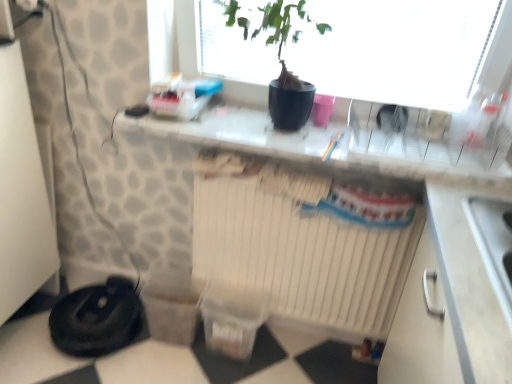
What do you see at coordinates (334, 150) in the screenshot? I see `white glossy countertop at center` at bounding box center [334, 150].

Where is `black matte pot at upper center`? This screenshot has height=384, width=512. black matte pot at upper center is located at coordinates (286, 67).

The image size is (512, 384). Identify the location of white glossy countertop at center. (334, 150).

Considering the sizes of white glossy countertop at center and white matte radiator at center in the image, is white glossy countertop at center bigger or smaller than white matte radiator at center?

Clearly, white glossy countertop at center is smaller in size than white matte radiator at center.

Can you confirm if white glossy countertop at center is positioned to the right of white matte radiator at center?

Yes, white glossy countertop at center is to the right of white matte radiator at center.

Which object is further away from the camera taking this photo, white glossy countertop at center or white matte radiator at center?

white matte radiator at center is further from the camera.

Consider the image. Is white matte radiator at center to the left or to the right of black rubber vacuum cleaner at lower left in the image?

white matte radiator at center is positioned on black rubber vacuum cleaner at lower left's right side.

Is white matte radiator at center inside or outside of black rubber vacuum cleaner at lower left?

white matte radiator at center is not inside black rubber vacuum cleaner at lower left, it's outside.

Considering the positions of point (323, 307) and point (92, 301), is point (323, 307) closer or farther from the camera than point (92, 301)?

Point (323, 307) is positioned closer to the camera compared to point (92, 301).

Is white matte radiator at center placed right next to black rubber vacuum cleaner at lower left?

No, white matte radiator at center is not with black rubber vacuum cleaner at lower left.

Is black matte pot at upper center not near black rubber vacuum cleaner at lower left?

Yes, black matte pot at upper center is far from black rubber vacuum cleaner at lower left.

Is black rubber vacuum cleaner at lower left completely or partially inside black matte pot at upper center?

No, black rubber vacuum cleaner at lower left is located outside of black matte pot at upper center.

In the image, is white glossy countertop at center on the left side or the right side of black rubber vacuum cleaner at lower left?

white glossy countertop at center is to the right of black rubber vacuum cleaner at lower left.

Is white glossy countertop at center placed right next to black rubber vacuum cleaner at lower left?

No, white glossy countertop at center is not making contact with black rubber vacuum cleaner at lower left.

From the image's perspective, is white glossy countertop at center beneath black rubber vacuum cleaner at lower left?

Incorrect, from the image's perspective, white glossy countertop at center is higher than black rubber vacuum cleaner at lower left.

Locate an element on the screen. counter top on the right of black rubber vacuum cleaner at lower left is located at coordinates (334, 150).

This screenshot has height=384, width=512. What are the coordinates of `counter top lying on the right of black matte pot at upper center` in the screenshot? It's located at (334, 150).

Which object is positioned more to the left, black matte pot at upper center or white glossy countertop at center?

From the viewer's perspective, black matte pot at upper center appears more on the left side.

Is black matte pot at upper center next to white glossy countertop at center?

No, black matte pot at upper center is not in contact with white glossy countertop at center.

Considering their positions, is black matte pot at upper center located in front of or behind white glossy countertop at center?

Clearly, black matte pot at upper center is in front of white glossy countertop at center.

Is white glossy countertop at center not inside black matte pot at upper center?

Yes.

Which of these two, white glossy countertop at center or black matte pot at upper center, stands shorter?

white glossy countertop at center.

Looking at this image, can you confirm if white glossy countertop at center is thinner than black matte pot at upper center?

No.

Is the surface of white glossy countertop at center in direct contact with black matte pot at upper center?

white glossy countertop at center and black matte pot at upper center are not in contact.

Does point (49, 324) appear closer or farther from the camera than point (309, 103)?

Clearly, point (49, 324) is more distant from the camera than point (309, 103).

Is black rubber vacuum cleaner at lower left facing towards black matte pot at upper center?

No, black rubber vacuum cleaner at lower left does not turn towards black matte pot at upper center.

From the image's perspective, which one is positioned higher, black rubber vacuum cleaner at lower left or black matte pot at upper center?

black matte pot at upper center is shown above in the image.

Where is `houseplant on the right side of black rubber vacuum cleaner at lower left`? This screenshot has width=512, height=384. houseplant on the right side of black rubber vacuum cleaner at lower left is located at coordinates (286, 67).

You are a GUI agent. You are given a task and a screenshot of the screen. Output one action in this format:
    pyautogui.click(x=<x>, y=<y>)
    Task: Click on the counter top above the white matte radiator at center (from the image's perspective)
    The height and width of the screenshot is (384, 512).
    Given the screenshot: What is the action you would take?
    pyautogui.click(x=334, y=150)

At what (x,y) coordinates should I click in order to perform the action: click on appliance below the white matte radiator at center (from the image's perspective). Please return your answer as a coordinate pair (x, y). Looking at the image, I should click on (97, 318).

When comparing their distances from black rubber vacuum cleaner at lower left, does white matte radiator at center or white glossy countertop at center seem further?

white glossy countertop at center is positioned further to the anchor black rubber vacuum cleaner at lower left.

Looking at the image, which one is located further to white glossy countertop at center, black matte pot at upper center or black rubber vacuum cleaner at lower left?

Based on the image, black rubber vacuum cleaner at lower left appears to be further to white glossy countertop at center.

From the image, which object appears to be farther from white glossy countertop at center, black rubber vacuum cleaner at lower left or white matte radiator at center?

The object further to white glossy countertop at center is black rubber vacuum cleaner at lower left.

From the image, which object appears to be nearer to white glossy countertop at center, black rubber vacuum cleaner at lower left or black matte pot at upper center?

black matte pot at upper center.

Considering their positions, is black rubber vacuum cleaner at lower left positioned closer to black matte pot at upper center than white matte radiator at center?

white matte radiator at center.

Estimate the real-world distances between objects in this image. Which object is closer to black matte pot at upper center, white matte radiator at center or black rubber vacuum cleaner at lower left?

Based on the image, white matte radiator at center appears to be nearer to black matte pot at upper center.

Based on their spatial positions, is white matte radiator at center or black matte pot at upper center closer to white glossy countertop at center?

black matte pot at upper center.

Which object lies nearer to the anchor point white matte radiator at center, black matte pot at upper center or black rubber vacuum cleaner at lower left?

Based on the image, black matte pot at upper center appears to be nearer to white matte radiator at center.

This screenshot has width=512, height=384. What are the coordinates of `counter top between black matte pot at upper center and white matte radiator at center vertically` in the screenshot? It's located at (334, 150).

Where is `radiator between black matte pot at upper center and black rubber vacuum cleaner at lower left in the up-down direction`? radiator between black matte pot at upper center and black rubber vacuum cleaner at lower left in the up-down direction is located at coordinates (298, 248).

This screenshot has height=384, width=512. In order to click on radiator between black rubber vacuum cleaner at lower left and white glossy countertop at center from left to right in this screenshot , I will do click(298, 248).

This screenshot has width=512, height=384. I want to click on counter top that lies between black matte pot at upper center and black rubber vacuum cleaner at lower left from top to bottom, so click(334, 150).